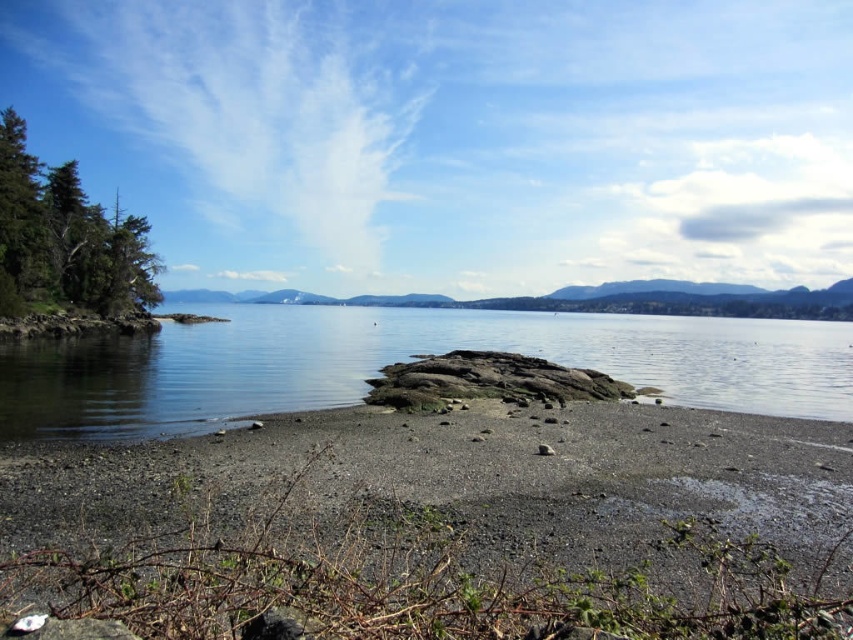
Question: Which object is the closest to the clear water at center?

Choices:
 (A) smooth pebbles at center
 (B) green textured tree at left

Answer: (B)

Question: Which object is positioned closest to the smooth pebbles at center?

Choices:
 (A) clear water at center
 (B) green textured tree at left

Answer: (A)

Question: Which object is farther from the camera taking this photo?

Choices:
 (A) smooth pebbles at center
 (B) clear water at center
 (C) green textured tree at left

Answer: (C)

Question: Is smooth pebbles at center further to the viewer compared to green textured tree at left?

Choices:
 (A) yes
 (B) no

Answer: (B)

Question: From the image, what is the correct spatial relationship of smooth pebbles at center in relation to green textured tree at left?

Choices:
 (A) below
 (B) above

Answer: (A)

Question: Does smooth pebbles at center appear on the left side of green textured tree at left?

Choices:
 (A) no
 (B) yes

Answer: (A)